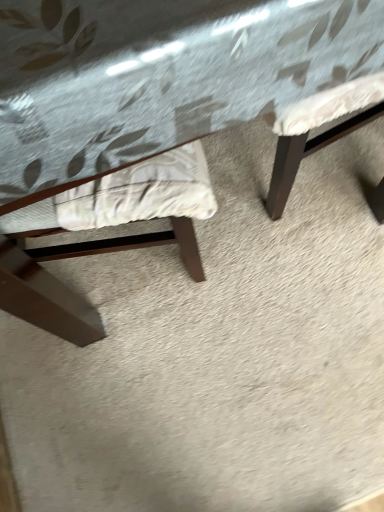
Measure the distance between wooden table at center and camera.

The distance of wooden table at center from camera is 13.34 inches.

Image resolution: width=384 pixels, height=512 pixels. Describe the element at coordinates (157, 115) in the screenshot. I see `wooden table at center` at that location.

Find the location of `wooden table at center`. wooden table at center is located at coordinates (157, 115).

Consider the image. What is the approximate height of fabric cushioned chair at left?

The height of fabric cushioned chair at left is 32.17 inches.

The image size is (384, 512). Find the location of `fabric cushioned chair at left`. fabric cushioned chair at left is located at coordinates (111, 239).

The width and height of the screenshot is (384, 512). What do you see at coordinates (111, 239) in the screenshot? I see `fabric cushioned chair at left` at bounding box center [111, 239].

Locate an element on the screen. The height and width of the screenshot is (512, 384). wooden table at center is located at coordinates (157, 115).

Which object is positioned more to the right, fabric cushioned chair at left or wooden table at center?

From the viewer's perspective, wooden table at center appears more on the right side.

Consider the image. Is the depth of fabric cushioned chair at left less than that of wooden table at center?

No, the depth of fabric cushioned chair at left is greater than that of wooden table at center.

Is point (203, 188) closer to camera compared to point (172, 56)?

No, (203, 188) is further to viewer.

From the image's perspective, which object appears higher, fabric cushioned chair at left or wooden table at center?

wooden table at center, from the image's perspective.

From a real-world perspective, is fabric cushioned chair at left physically located above or below wooden table at center?

Clearly, from a real-world perspective, fabric cushioned chair at left is above wooden table at center.

Based on the photo, is fabric cushioned chair at left wider than wooden table at center?

Incorrect, the width of fabric cushioned chair at left does not surpass that of wooden table at center.

Can you confirm if fabric cushioned chair at left is taller than wooden table at center?

Correct, fabric cushioned chair at left is much taller as wooden table at center.

Is fabric cushioned chair at left bigger than wooden table at center?

Incorrect, fabric cushioned chair at left is not larger than wooden table at center.

Is wooden table at center surrounded by fabric cushioned chair at left?

No, wooden table at center is not surrounded by fabric cushioned chair at left.

Is fabric cushioned chair at left placed right next to wooden table at center?

Yes, fabric cushioned chair at left is touching wooden table at center.

Is fabric cushioned chair at left aimed at wooden table at center?

Yes, fabric cushioned chair at left is facing wooden table at center.

Where is `table below the fabric cushioned chair at left (from a real-world perspective)`? The image size is (384, 512). table below the fabric cushioned chair at left (from a real-world perspective) is located at coordinates (157, 115).

In the image, is wooden table at center on the left side or the right side of fabric cushioned chair at left?

wooden table at center is to the right of fabric cushioned chair at left.

Is the depth of wooden table at center less than that of fabric cushioned chair at left?

Yes, it is.

Which point is more forward, (81, 80) or (87, 309)?

Positioned in front is point (81, 80).

From the image's perspective, is wooden table at center beneath fabric cushioned chair at left?

Incorrect, from the image's perspective, wooden table at center is higher than fabric cushioned chair at left.

From a real-world perspective, between wooden table at center and fabric cushioned chair at left, who is vertically lower?

wooden table at center, from a real-world perspective.

Considering the relative sizes of wooden table at center and fabric cushioned chair at left in the image provided, is wooden table at center thinner than fabric cushioned chair at left?

No, wooden table at center is not thinner than fabric cushioned chair at left.

Can you confirm if wooden table at center is taller than fabric cushioned chair at left?

In fact, wooden table at center may be shorter than fabric cushioned chair at left.

Can you confirm if wooden table at center is bigger than fabric cushioned chair at left?

Indeed, wooden table at center has a larger size compared to fabric cushioned chair at left.

Is wooden table at center inside the boundaries of fabric cushioned chair at left, or outside?

wooden table at center cannot be found inside fabric cushioned chair at left.

Is wooden table at center not close to fabric cushioned chair at left?

No, wooden table at center is not far away from fabric cushioned chair at left.

Is wooden table at center oriented towards fabric cushioned chair at left?

Yes, wooden table at center is facing fabric cushioned chair at left.

This screenshot has height=512, width=384. I want to click on chair to the left of wooden table at center, so click(111, 239).

The height and width of the screenshot is (512, 384). Identify the location of table that appears in front of the fabric cushioned chair at left. (157, 115).

The height and width of the screenshot is (512, 384). What are the coordinates of `table that appears on the right of fabric cushioned chair at left` in the screenshot? It's located at (157, 115).